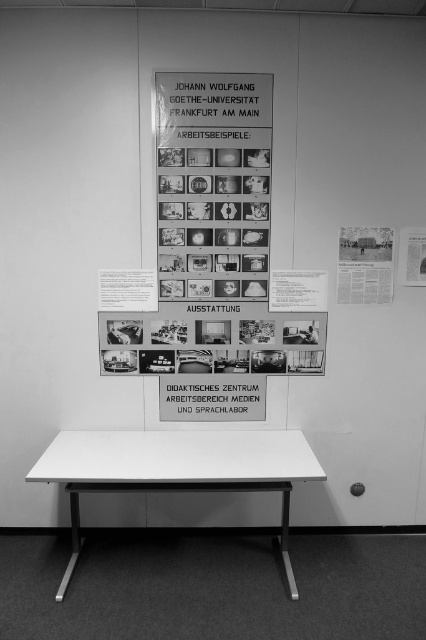
Question: Which object appears farthest from the camera in this image?

Choices:
 (A) white matte table at center
 (B) matte paper poster at upper right

Answer: (B)

Question: From the image, what is the correct spatial relationship of white matte table at center in relation to matte paper poster at upper right?

Choices:
 (A) left
 (B) right

Answer: (A)

Question: Does white matte table at center have a lesser width compared to matte paper poster at upper right?

Choices:
 (A) no
 (B) yes

Answer: (A)

Question: Is the position of matte paper poster at upper right more distant than that of white paper at upper right?

Choices:
 (A) no
 (B) yes

Answer: (A)

Question: Which point is closer to the camera?

Choices:
 (A) white matte table at center
 (B) matte paper poster at upper right

Answer: (A)

Question: Which point appears farthest from the camera in this image?

Choices:
 (A) (416, 262)
 (B) (362, 241)

Answer: (A)